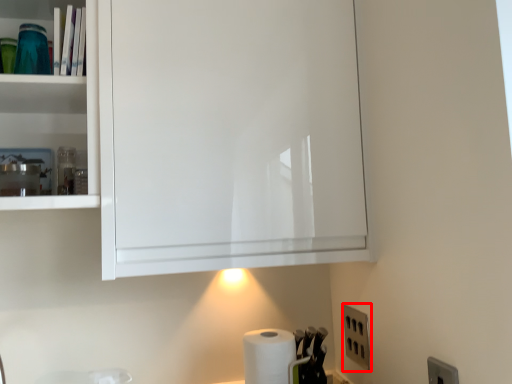
Question: From the image's perspective, what is the correct spatial relationship of electric outlet (annotated by the red box) in relation to paper towel?

Choices:
 (A) below
 (B) above

Answer: (B)